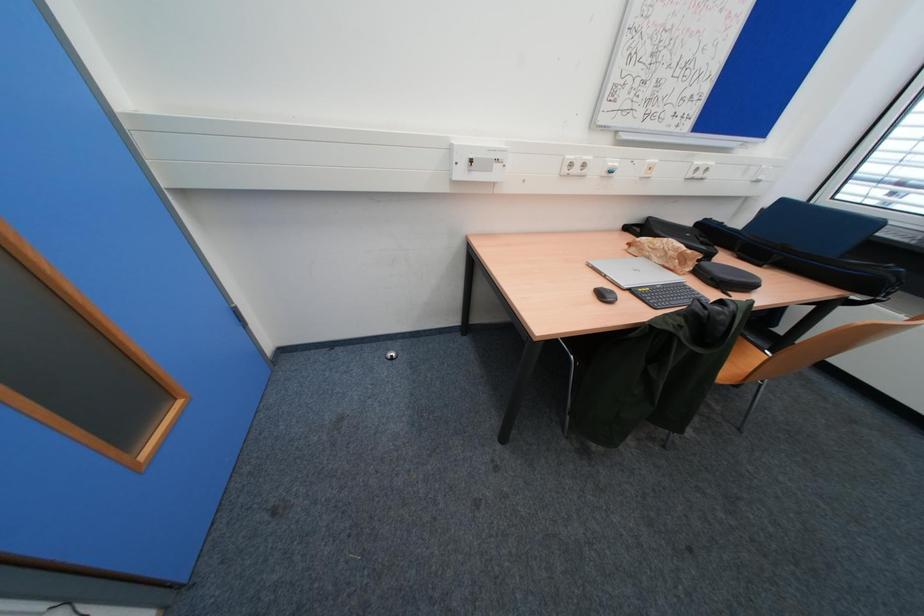
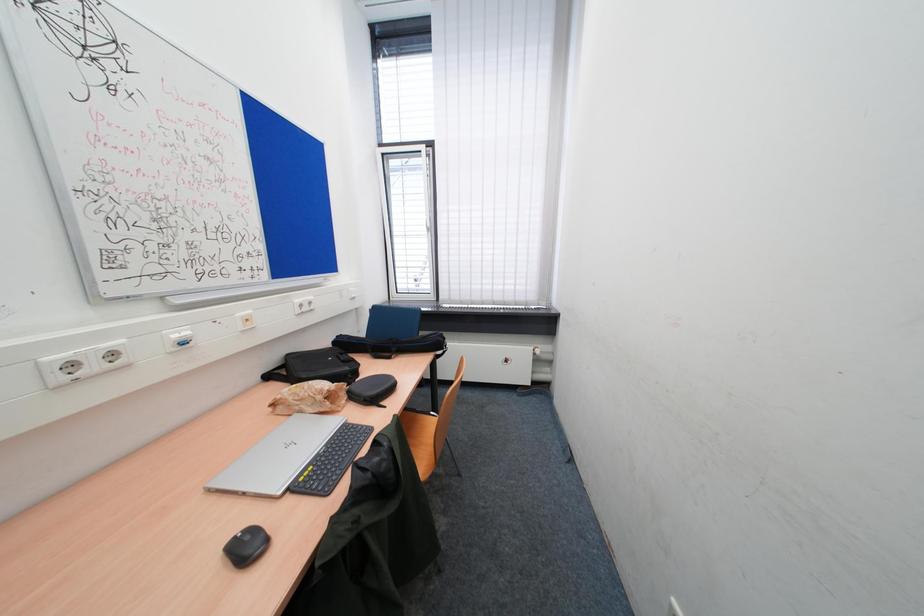
Question: Based on the continuous images, in which direction is the camera rotating? Reply with the corresponding letter.

Choices:
 (A) Left
 (B) Right
 (C) Up
 (D) Down

Answer: (B)